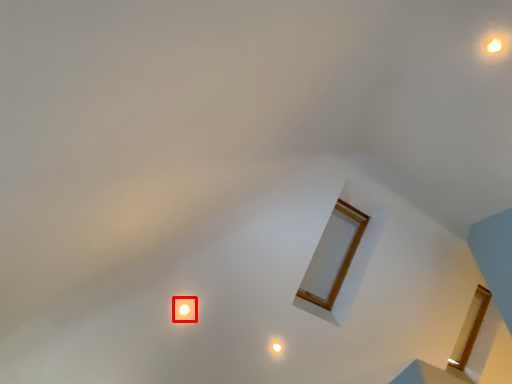
Question: From the image's perspective, what is the correct spatial positioning of glow (annotated by the red box) in reference to light?

Choices:
 (A) above
 (B) below

Answer: (A)